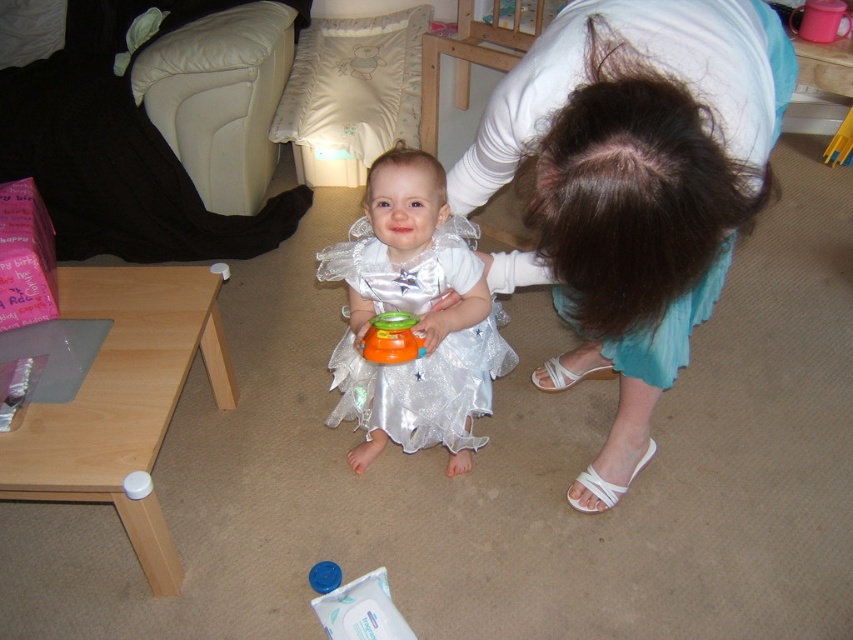
Question: Does satin white dress at center have a greater width compared to orange rubber toy at center?

Choices:
 (A) no
 (B) yes

Answer: (B)

Question: Considering the real-world distances, which object is farthest from the white satin dress at upper center?

Choices:
 (A) black leather couch at upper left
 (B) orange rubber toy at center

Answer: (A)

Question: Does satin white dress at center have a lesser width compared to blue plastic toy at lower center?

Choices:
 (A) yes
 (B) no

Answer: (B)

Question: Which point is closer to the camera taking this photo?

Choices:
 (A) (373, 413)
 (B) (202, 220)
 (C) (376, 348)

Answer: (C)

Question: Does white satin dress at upper center come in front of blue plastic toy at lower center?

Choices:
 (A) yes
 (B) no

Answer: (A)

Question: Which object appears closest to the camera in this image?

Choices:
 (A) blue plastic toy at lower center
 (B) white satin dress at upper center
 (C) satin white dress at center
 (D) black leather couch at upper left

Answer: (B)